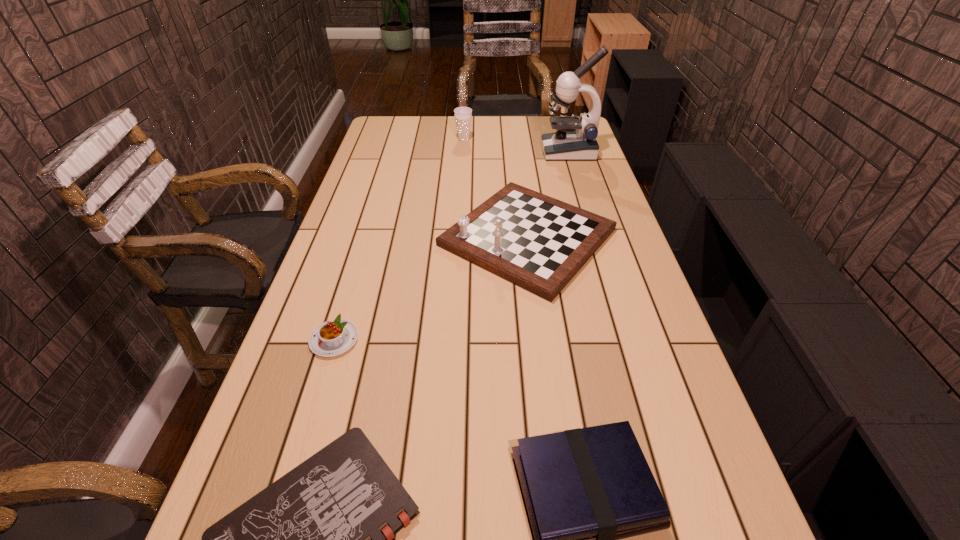
You are a GUI agent. You are given a task and a screenshot of the screen. Output one action in this format:
    pyautogui.click(x=<x>, y=<y>)
    Task: Click on the object that is at the left edge
    The height and width of the screenshot is (540, 960).
    Given the screenshot: What is the action you would take?
    pyautogui.click(x=334, y=337)

You are a GUI agent. You are given a task and a screenshot of the screen. Output one action in this format:
    pyautogui.click(x=<x>, y=<y>)
    Task: Click on the microscope positioned at the right edge
    The width and height of the screenshot is (960, 540).
    Given the screenshot: What is the action you would take?
    pyautogui.click(x=575, y=139)

This screenshot has width=960, height=540. I want to click on gameboard at the right edge, so click(x=539, y=243).

The width and height of the screenshot is (960, 540). Find the location of `free space at the far edge of the desktop`. free space at the far edge of the desktop is located at coordinates (442, 129).

This screenshot has width=960, height=540. Find the location of `vacant region at the left edge`. vacant region at the left edge is located at coordinates (355, 274).

You are a GUI agent. You are given a task and a screenshot of the screen. Output one action in this format:
    pyautogui.click(x=<x>, y=<y>)
    Task: Click on the vacant region at the far left corner of the desktop
    
    Given the screenshot: What is the action you would take?
    pyautogui.click(x=375, y=136)

This screenshot has width=960, height=540. In order to click on empty space between the cup and the fourth nearest object in this screenshot , I will do `click(495, 188)`.

Identify the location of vacant area between the cup and the microscope. (516, 146).

Identify the location of vacant area that lies between the cup and the second shortest object. The height and width of the screenshot is (540, 960). (399, 240).

The width and height of the screenshot is (960, 540). Identify the location of vacant region between the third farthest object and the third nearest object. (431, 288).